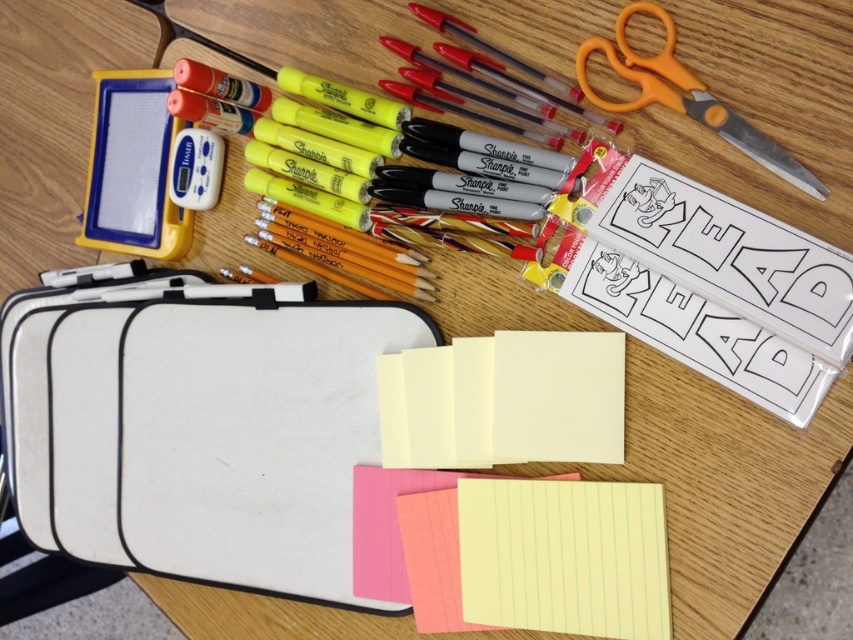
Question: Which object is closer to the camera taking this photo?

Choices:
 (A) orange plastic scissors at upper right
 (B) lined paper at center
 (C) yellow paper notepad at center

Answer: (A)

Question: Which of these objects is positioned closest to the lined paper at center?

Choices:
 (A) yellow paper notepad at center
 (B) orange plastic scissors at upper right

Answer: (A)

Question: Among these points, which one is farthest from the camera?

Choices:
 (A) (381, 524)
 (B) (503, 356)
 (C) (792, 182)

Answer: (A)

Question: Can you confirm if yellow paper notepad at center is wider than orange plastic scissors at upper right?

Choices:
 (A) yes
 (B) no

Answer: (A)

Question: Is yellow paper notepad at center above lined paper at center?

Choices:
 (A) yes
 (B) no

Answer: (A)

Question: Can you confirm if orange plastic scissors at upper right is positioned above lined paper at center?

Choices:
 (A) no
 (B) yes

Answer: (B)